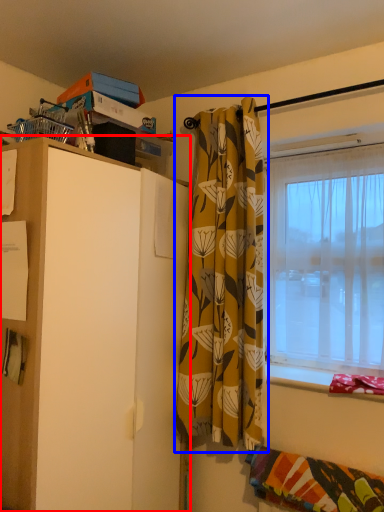
Question: Which point is further to the camera, cabinetry (highlighted by a red box) or curtain (highlighted by a blue box)?

Choices:
 (A) cabinetry
 (B) curtain

Answer: (B)